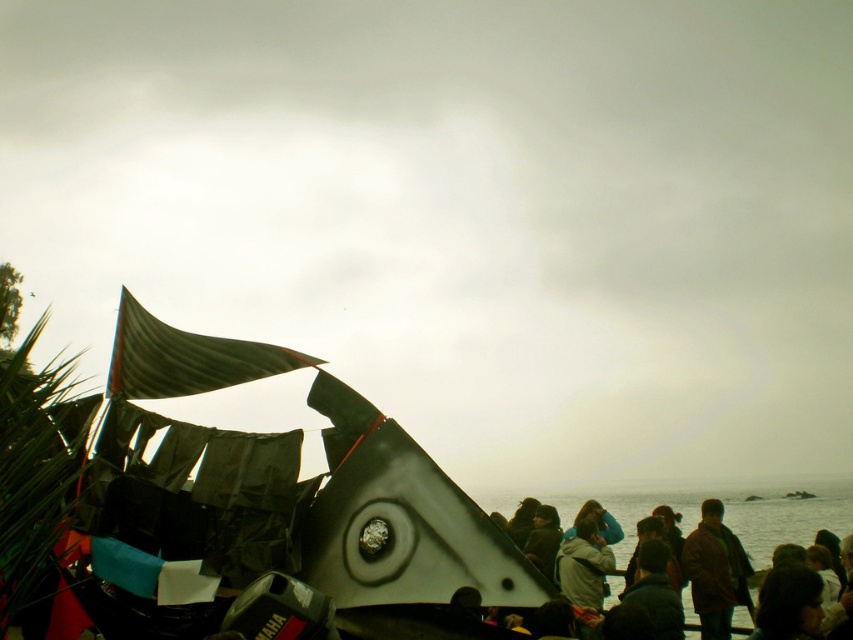
You are standing at the center of the image and want to move towards the shiny metallic boat at left. Which direction should you walk to avoid the brown woolen coat at lower right?

Since the shiny metallic boat at left is located above the brown woolen coat at lower right, you should walk towards the upper left direction to reach the boat while avoiding the coat.

You are a photographer trying to capture a closeup of the dark gray jacket at lower right and the brown woolen coat at lower right. Since you can only focus on one at a time, which one should you choose if you want to show more details in your photo?

The dark gray jacket at lower right is larger in size than the brown woolen coat at lower right, so choosing the dark gray jacket at lower right would allow you to show more details in your photo.